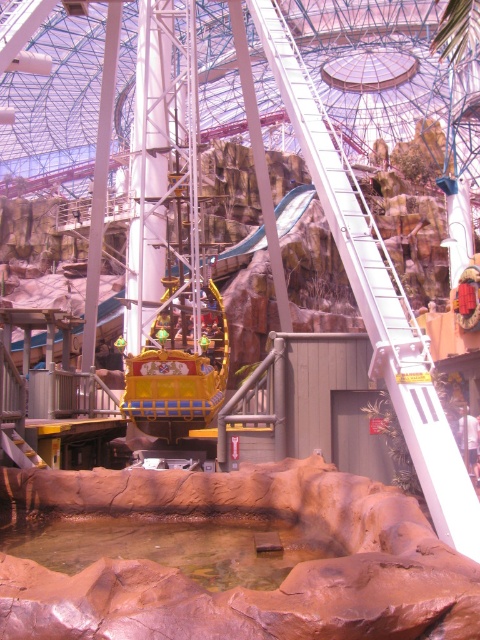
Question: Which point is farther to the camera?

Choices:
 (A) smooth stone water at lower center
 (B) shiny gold boat at center

Answer: (B)

Question: Among these points, which one is nearest to the camera?

Choices:
 (A) (24, 616)
 (B) (192, 406)

Answer: (A)

Question: Observing the image, what is the correct spatial positioning of smooth stone water at lower center in reference to shiny gold boat at center?

Choices:
 (A) above
 (B) below

Answer: (B)

Question: Is smooth stone water at lower center to the left of shiny gold boat at center from the viewer's perspective?

Choices:
 (A) no
 (B) yes

Answer: (A)

Question: Can you confirm if smooth stone water at lower center is positioned to the left of shiny gold boat at center?

Choices:
 (A) no
 (B) yes

Answer: (A)